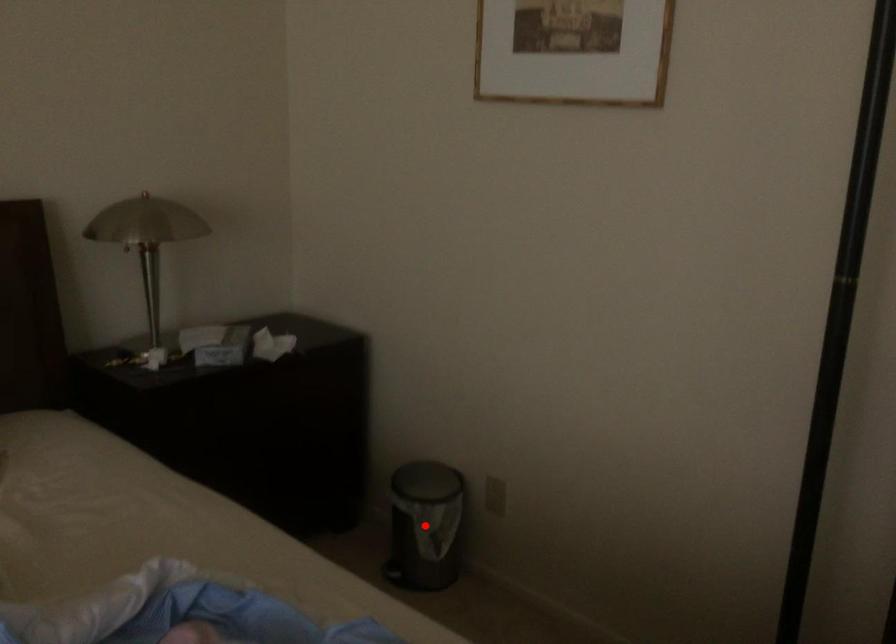
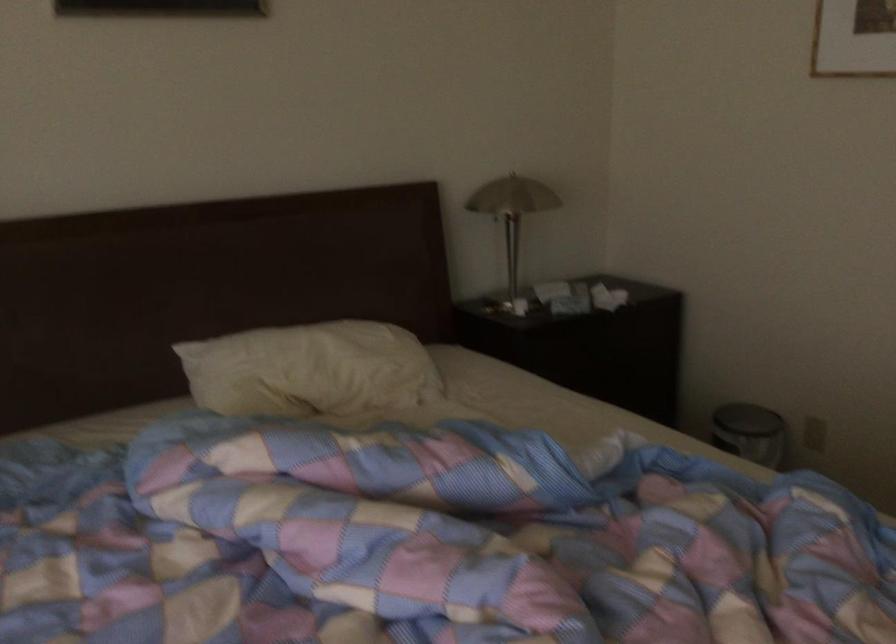
Question: I am providing you with two images of the same scene from different viewpoints. A red point is marked on the first image. Can you still see the location of the red point in image 2?

Choices:
 (A) Yes
 (B) No

Answer: (B)